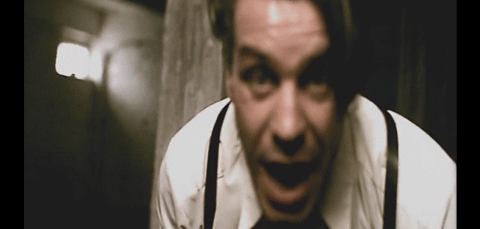
Locate an element on the screen. The width and height of the screenshot is (480, 229). wall is located at coordinates (177, 72).